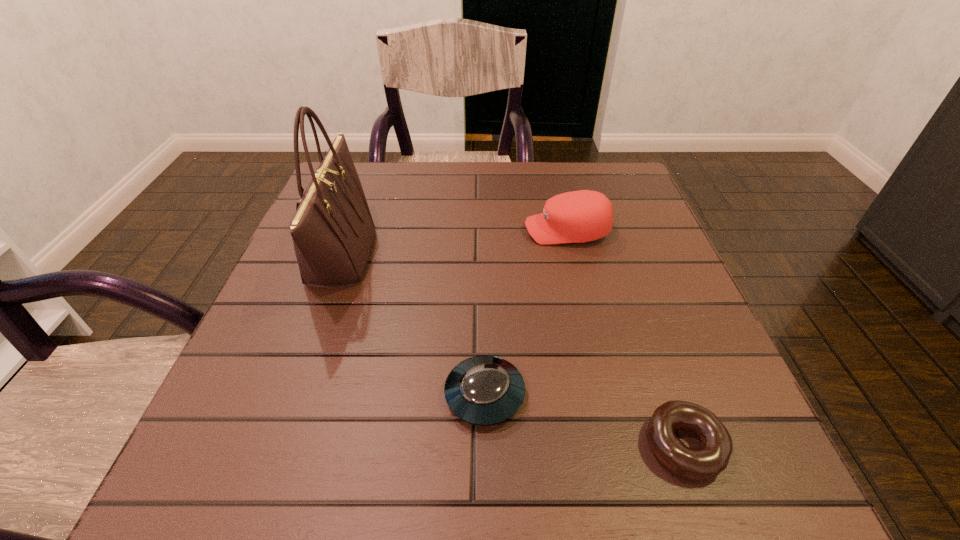
Locate an element on the screen. handbag is located at coordinates (333, 232).

What are the coordinates of `the leftmost object` in the screenshot? It's located at (333, 232).

Find the location of `the third shortest object`. the third shortest object is located at coordinates (581, 216).

This screenshot has height=540, width=960. Identify the location of saucer. (483, 390).

What are the coordinates of `doughnut` in the screenshot? It's located at (707, 462).

The width and height of the screenshot is (960, 540). Identify the location of free space located 0.070m on the front-facing side of the handbag. (404, 255).

Find the location of a particular element. free region located 0.130m on the front-facing side of the third shortest object is located at coordinates (467, 231).

Where is `free space located on the front-facing side of the third shortest object`? This screenshot has height=540, width=960. free space located on the front-facing side of the third shortest object is located at coordinates (356, 231).

This screenshot has height=540, width=960. In order to click on free spot located on the front-facing side of the third shortest object in this screenshot , I will do `click(409, 231)`.

In order to click on vacant area situated 0.080m on the back of the saucer in this screenshot , I will do `click(484, 326)`.